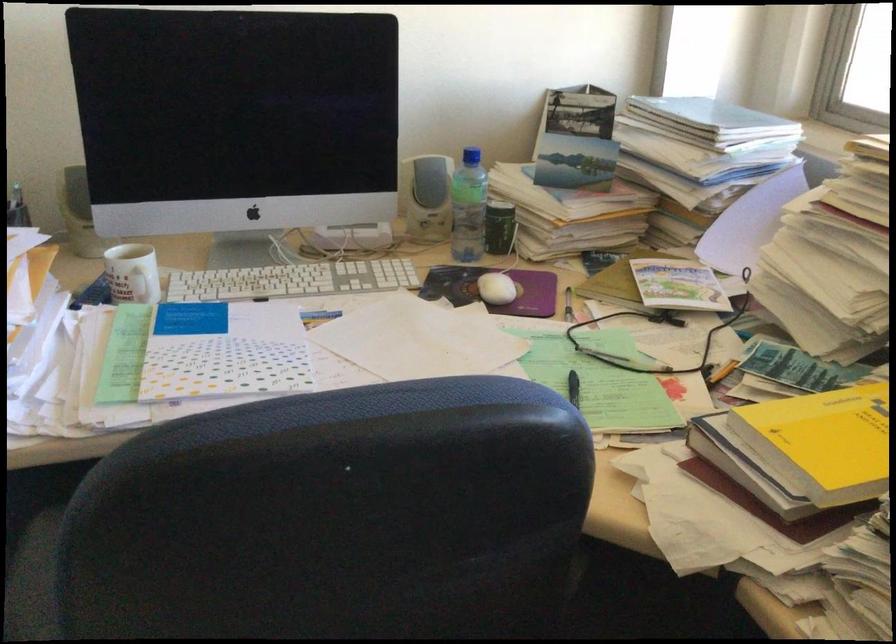
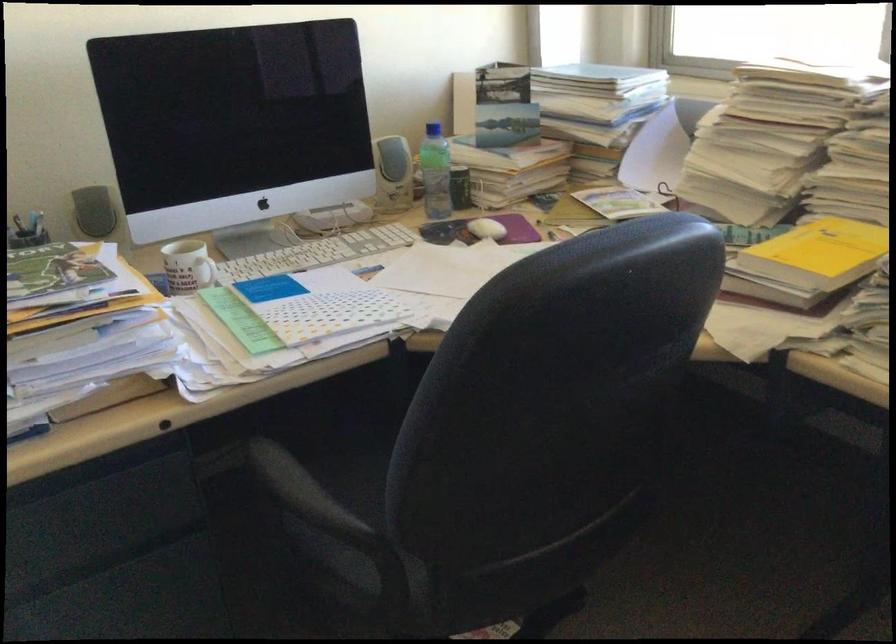
The point at (x=426, y=203) is marked in the first image. Where is the corresponding point in the second image?

(392, 174)